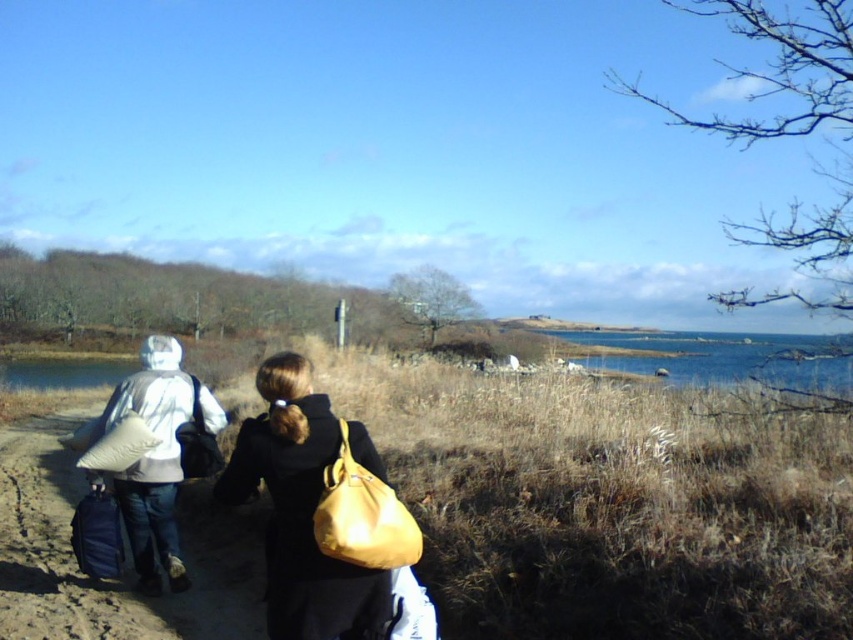
Can you confirm if matte white pillow at left is positioned to the right of matte yellow bag at center?

Incorrect, matte white pillow at left is not on the right side of matte yellow bag at center.

Does matte white pillow at left have a larger size compared to matte yellow bag at center?

Yes, matte white pillow at left is bigger than matte yellow bag at center.

What do you see at coordinates (144, 465) in the screenshot? I see `matte white pillow at left` at bounding box center [144, 465].

Locate an element on the screen. matte white pillow at left is located at coordinates (144, 465).

Is matte yellow bag at center shorter than matte black backpack at lower left?

Yes, matte yellow bag at center is shorter than matte black backpack at lower left.

Is matte yellow bag at center closer to camera compared to matte black backpack at lower left?

That is True.

Is point (386, 528) closer to viewer compared to point (80, 548)?

Yes.

What are the coordinates of `matte yellow bag at center` in the screenshot? It's located at (363, 515).

Can you confirm if blue water at right is positioned above matte black bag at left?

Actually, blue water at right is below matte black bag at left.

Is blue water at right positioned in front of matte black bag at left?

No.

Is point (799, 336) in front of point (206, 445)?

No, it is not.

Where is `blue water at right`? Image resolution: width=853 pixels, height=640 pixels. blue water at right is located at coordinates (724, 356).